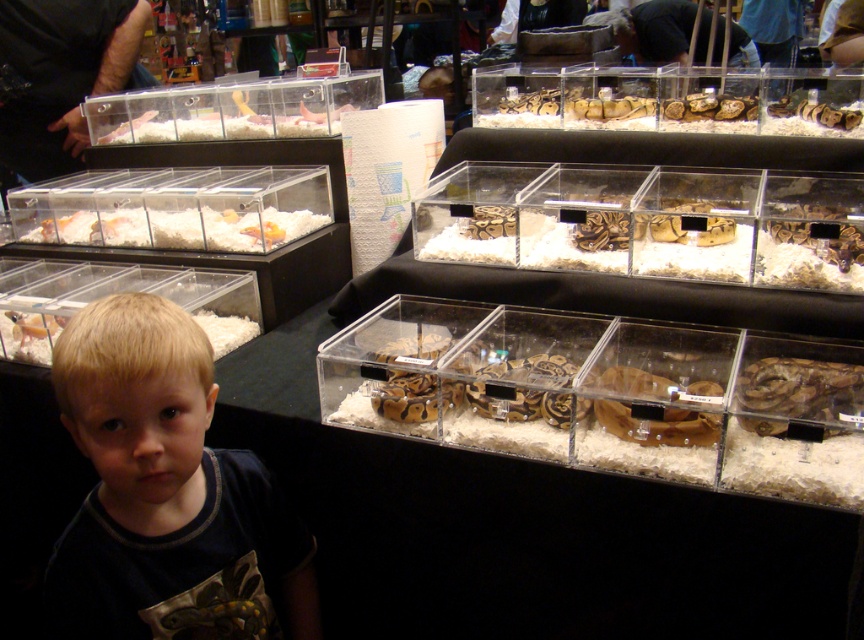
Who is taller, brown textured snake at upper center or white fluffy bedding at lower left?

brown textured snake at upper center is taller.

Is point (786, 104) behind point (221, 344)?

Yes.

I want to click on brown textured snake at upper center, so click(x=683, y=113).

Between point (445, 218) and point (94, 237), which one is positioned in front?

Point (445, 218)

Does brown patterned snake at center have a greater height compared to translucent plastic container at center?

Yes.

Find the location of `brown patterned snake at center`. brown patterned snake at center is located at coordinates (756, 248).

This screenshot has height=640, width=864. Identify the location of brown patterned snake at center. (756, 248).

Does brown patterned snake at center lie in front of brown textured snake at upper center?

Yes, it is in front of brown textured snake at upper center.

In the scene shown: Does brown patterned snake at center appear under brown textured snake at upper center?

Yes, brown patterned snake at center is below brown textured snake at upper center.

Which is behind, point (659, 212) or point (704, 104)?

Point (704, 104)

Locate an element on the screen. brown patterned snake at center is located at coordinates (756, 248).